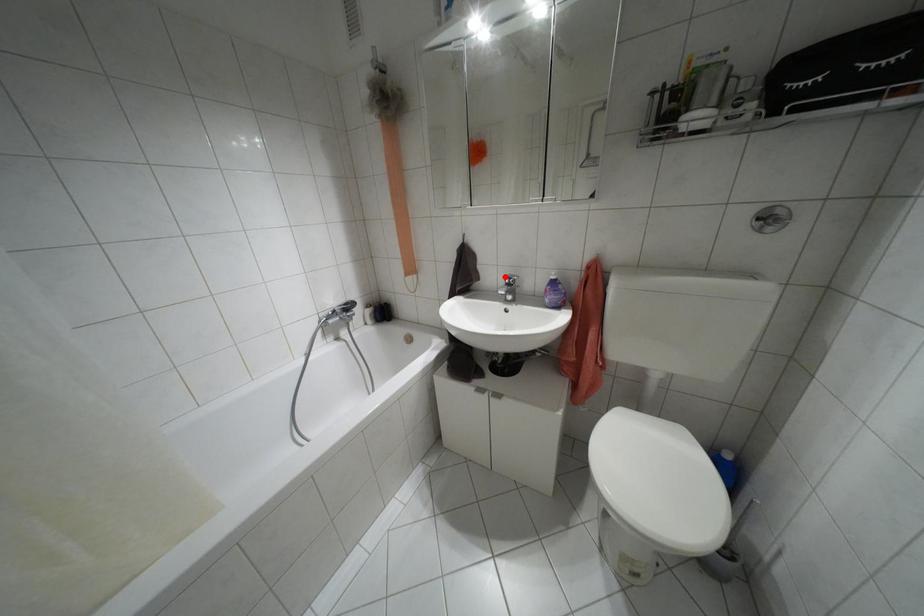
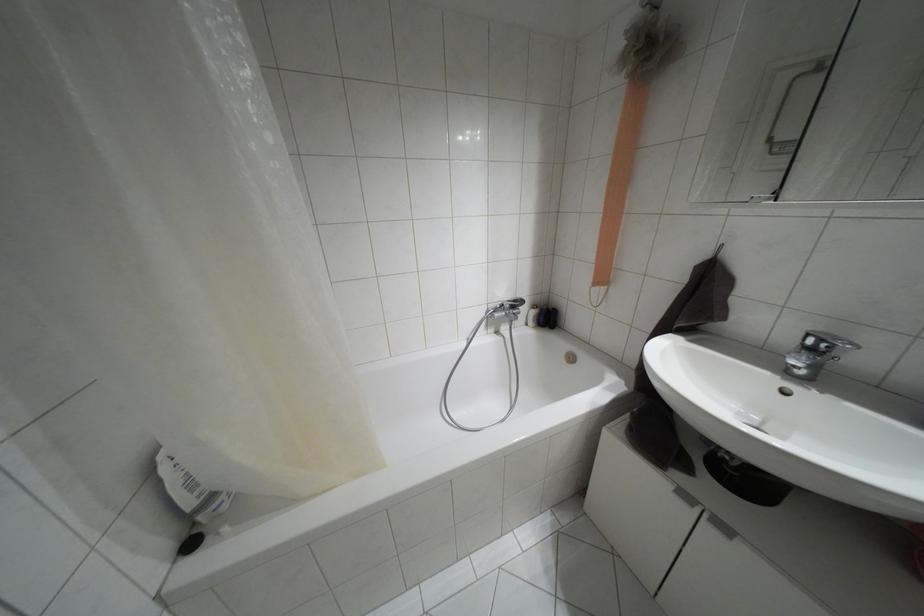
Find the pixel in the second image that matches the highlighted location in the first image.

(808, 334)